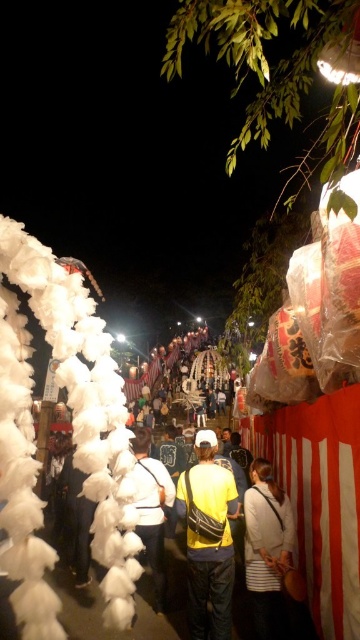
You are at the festival and have both a yellow fabric bag at center and a yellow fabric shirt at center. If you want to pack them into a small storage container, which item should you place first to maximize space efficiency?

You should place the yellow fabric bag at center first because it occupies less space than the yellow fabric shirt at center, allowing the larger item to be placed afterward without wasting space.

You are at the festival and want to take a photo of both the white fluffy cotton at left and the yellow fabric shirt at center. Which object should you focus on first to ensure both are in the frame?

To capture both the white fluffy cotton at left and the yellow fabric shirt at center in the same photo, focus on the white fluffy cotton at left first since it might be wider than the yellow fabric shirt at center, allowing you to adjust the camera angle to include both.